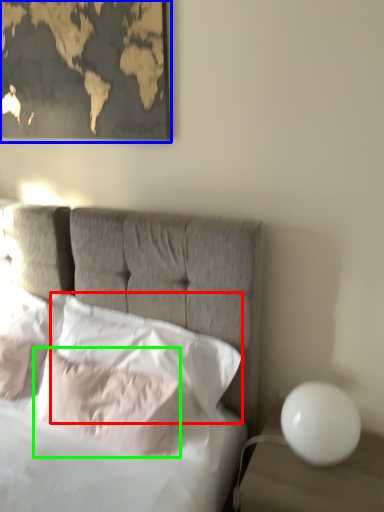
Question: Estimate the real-world distances between objects in this image. Which object is farther from pillow (highlighted by a red box), picture frame (highlighted by a blue box) or pillow (highlighted by a green box)?

Choices:
 (A) picture frame
 (B) pillow

Answer: (A)